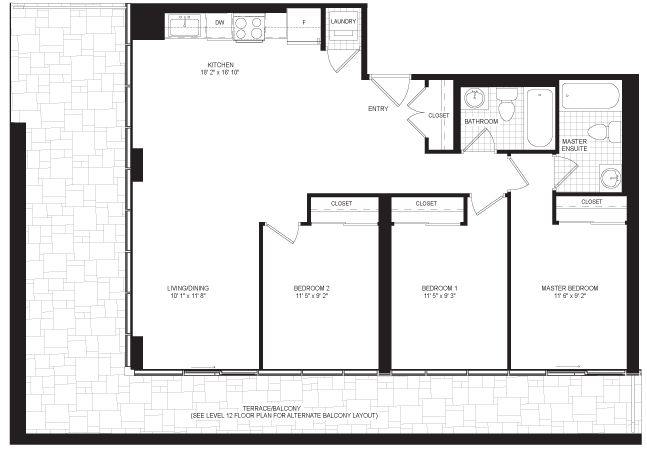
The height and width of the screenshot is (458, 647). I want to click on bathrooms, so click(510, 133), click(591, 168).